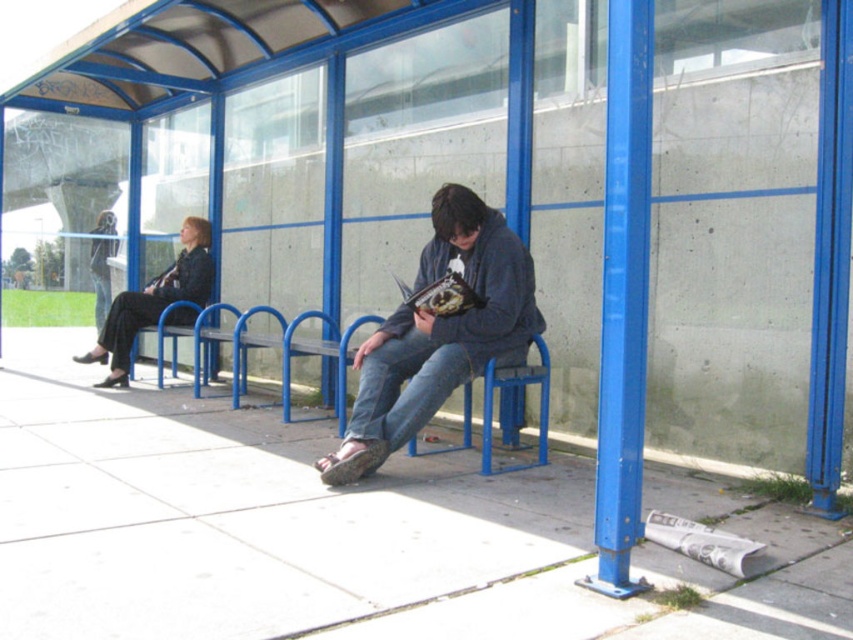
You are a pedestrian waiting at the bus stop shelter. You see a person wearing denim jeans at center and another wearing black leather jacket at left. Which clothing item is positioned more to the right side of the shelter?

The denim jeans at center are positioned more to the right side of the shelter compared to the black leather jacket at left.

You are a delivery person who needs to place a 10 feet long package between the denim jeans at center and the black leather jacket at left. Can you fit the package between them without moving either item?

The denim jeans at center and the black leather jacket at left are 12.13 feet apart, so the 10 feet long package can be placed between them as there is enough space.

Based on the photo, you are a photographer standing at the bus stop shelter. You want to take a photo of the black leather jacket at left without including the shelter structure in the frame. Is it possible to do so while maintaining the jacket as the main subject?

The black leather jacket at left is 7.34 meters away from the camera. Since the shelter structure is part of the background closer to the camera, it might be challenging to exclude it without cropping the jacket out of the frame. However, using a telephoto lens or moving closer could help isolate the jacket while keeping it in focus as the main subject.